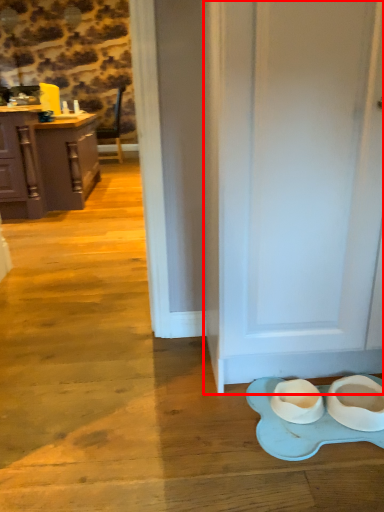
Question: In this image, where is door (annotated by the red box) located relative to cabinetry?

Choices:
 (A) left
 (B) right

Answer: (B)